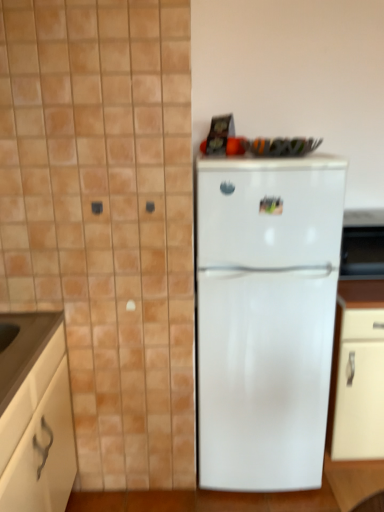
Question: From the image's perspective, is white glossy refrigerator at center located beneath white matte cabinet at lower left?

Choices:
 (A) yes
 (B) no

Answer: (B)

Question: From a real-world perspective, is white glossy refrigerator at center on white matte cabinet at lower left?

Choices:
 (A) no
 (B) yes

Answer: (B)

Question: Is the position of white glossy refrigerator at center more distant than that of white matte cabinet at lower left?

Choices:
 (A) no
 (B) yes

Answer: (B)

Question: Considering the relative sizes of white glossy refrigerator at center and white matte cabinet at lower left in the image provided, is white glossy refrigerator at center shorter than white matte cabinet at lower left?

Choices:
 (A) yes
 (B) no

Answer: (B)

Question: Is white glossy refrigerator at center at the left side of white matte cabinet at lower left?

Choices:
 (A) yes
 (B) no

Answer: (B)

Question: From the image's perspective, does white glossy refrigerator at center appear higher than white matte cabinet at lower left?

Choices:
 (A) no
 (B) yes

Answer: (B)

Question: From a real-world perspective, does white matte cabinet at lower left sit lower than white glossy refrigerator at center?

Choices:
 (A) yes
 (B) no

Answer: (A)

Question: Can you confirm if white matte cabinet at lower left is smaller than white glossy refrigerator at center?

Choices:
 (A) yes
 (B) no

Answer: (A)

Question: Is white matte cabinet at lower left oriented away from white glossy refrigerator at center?

Choices:
 (A) no
 (B) yes

Answer: (A)

Question: Is white matte cabinet at lower left bigger than white glossy refrigerator at center?

Choices:
 (A) yes
 (B) no

Answer: (B)

Question: Can you confirm if white matte cabinet at lower left is taller than white glossy refrigerator at center?

Choices:
 (A) yes
 (B) no

Answer: (B)

Question: Is white matte cabinet at lower left positioned beyond the bounds of white glossy refrigerator at center?

Choices:
 (A) no
 (B) yes

Answer: (B)

Question: From the image's perspective, is white glossy refrigerator at center positioned above or below white matte cabinet at lower left?

Choices:
 (A) below
 (B) above

Answer: (B)